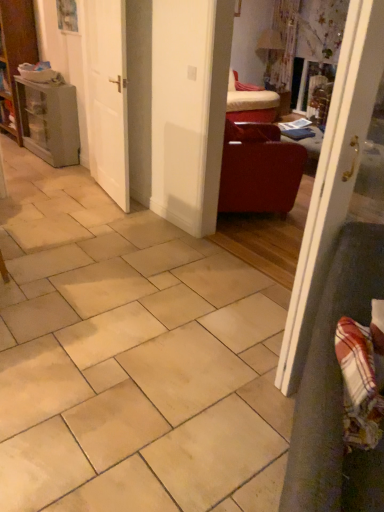
Locate an element on the screen. empty space that is ontop of beige ceramic tile at center (from a real-world perspective) is located at coordinates (116, 297).